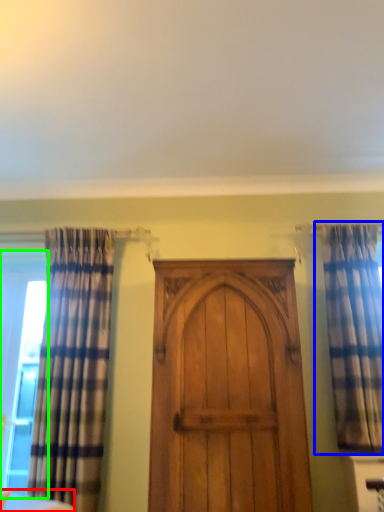
Question: Which object is the farthest from furniture (highlighted by a red box)? Choose among these: curtain (highlighted by a blue box) or window (highlighted by a green box).

Choices:
 (A) curtain
 (B) window

Answer: (A)